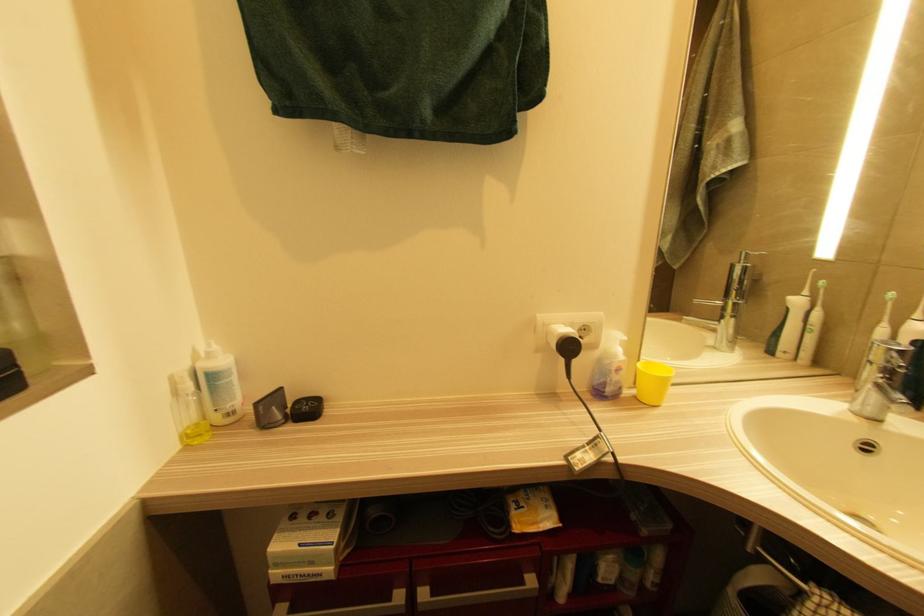
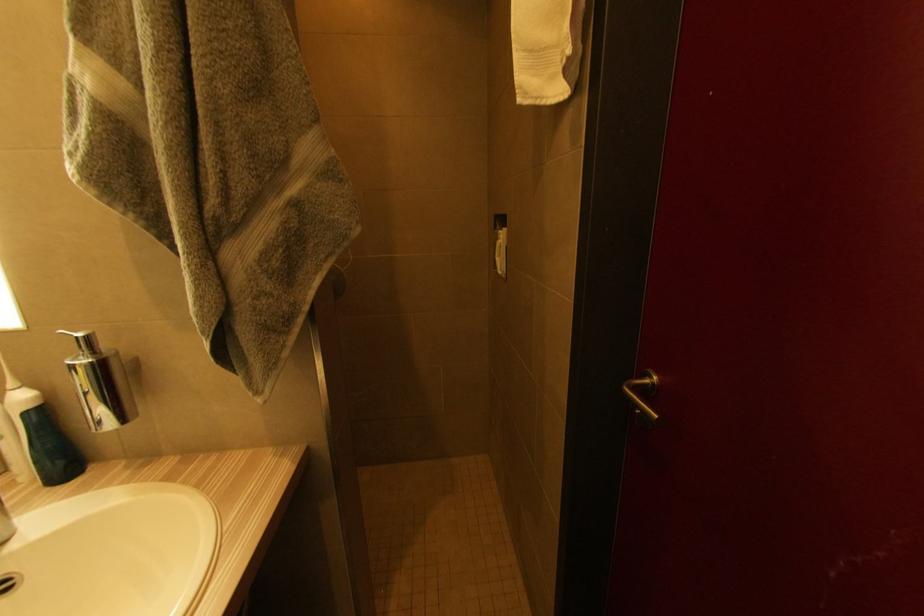
Based on the continuous images, in which direction is the camera rotating?

The camera rotated toward right-down.